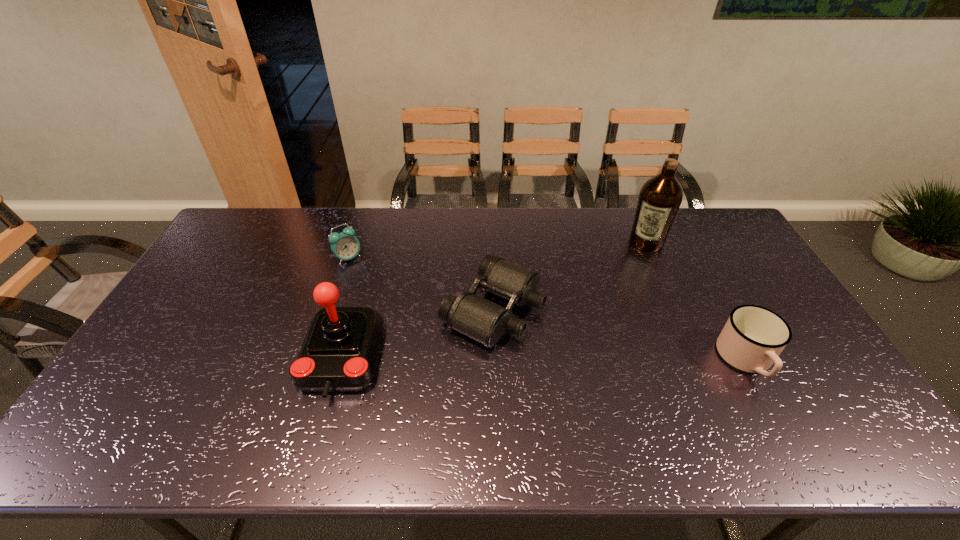
The image size is (960, 540). Find the location of `vacant space positioned 0.180m through the eyepieces of the third object from left to right`. vacant space positioned 0.180m through the eyepieces of the third object from left to right is located at coordinates (600, 360).

Identify the location of vacant space located on the face of the alarm clock. click(x=390, y=286).

You are a GUI agent. You are given a task and a screenshot of the screen. Output one action in this format:
    pyautogui.click(x=<x>, y=<y>)
    Task: Click on the vacant space situated 0.130m on the face of the alarm clock
    
    Given the screenshot: What is the action you would take?
    pyautogui.click(x=382, y=281)

Find the location of a particular element. vacant space located on the face of the alarm clock is located at coordinates (429, 314).

The image size is (960, 540). Identify the location of object that is positioned at the far edge. (660, 197).

This screenshot has width=960, height=540. In order to click on joystick located in the near edge section of the desktop in this screenshot , I will do `click(339, 352)`.

In order to click on mug that is at the near edge in this screenshot , I will do `click(753, 337)`.

This screenshot has height=540, width=960. Identify the location of object located in the right edge section of the desktop. (753, 337).

Where is `object situated at the near right corner`? object situated at the near right corner is located at coordinates (753, 337).

The image size is (960, 540). Identify the location of vacant region at the far edge of the desktop. (330, 233).